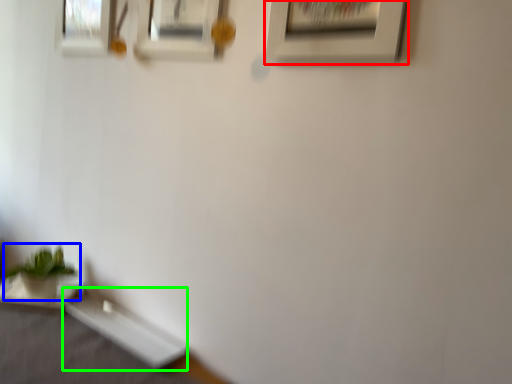
Question: Estimate the real-world distances between objects in this image. Which object is farther from picture frame (highlighted by a red box), houseplant (highlighted by a blue box) or table (highlighted by a green box)?

Choices:
 (A) houseplant
 (B) table

Answer: (A)